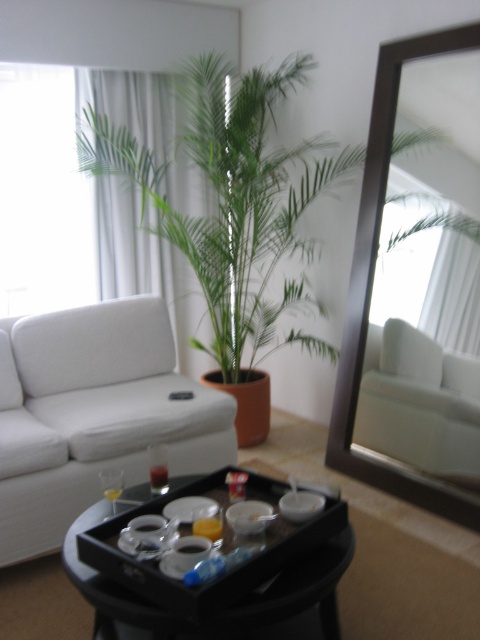
Between point (10, 365) and point (359, 476), which one is positioned in front?

Point (10, 365) is more forward.

Can you confirm if white fabric couch at left is wider than brown wooden mirror at upper right?

Yes.

Where is `white fabric couch at left`? This screenshot has height=640, width=480. white fabric couch at left is located at coordinates (94, 413).

The width and height of the screenshot is (480, 640). Find the location of `white fabric couch at left`. white fabric couch at left is located at coordinates (94, 413).

Can you confirm if white fabric couch at center is wider than translucent glass tray at center?

No.

Between white fabric couch at center and translucent glass tray at center, which one is positioned lower?

Positioned lower is translucent glass tray at center.

Is point (406, 337) closer to viewer compared to point (100, 568)?

That is False.

Find the location of a particular element. Image resolution: width=480 pixels, height=640 pixels. white fabric couch at center is located at coordinates (419, 403).

Identify the location of white fabric couch at left. (94, 413).

Between white fabric couch at left and white fabric couch at center, which one is positioned lower?

white fabric couch at center is below.

Between point (94, 346) and point (475, 461), which one is positioned in front?

Positioned in front is point (475, 461).

Locate an element on the screen. This screenshot has width=480, height=640. white fabric couch at left is located at coordinates (94, 413).